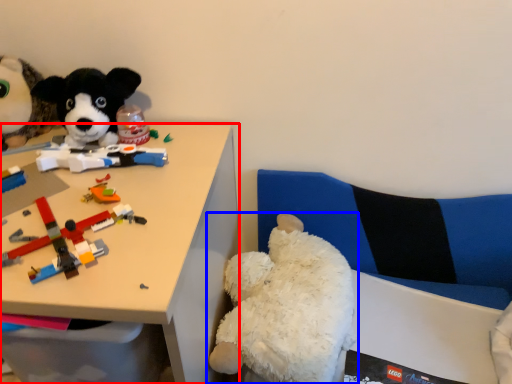
Question: Which object is closer to the camera taking this photo, desk (highlighted by a red box) or toy (highlighted by a blue box)?

Choices:
 (A) desk
 (B) toy

Answer: (A)